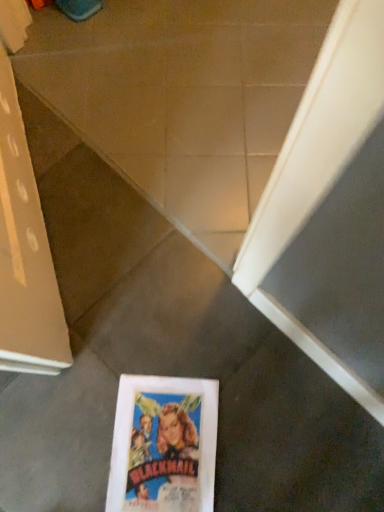
Question: In the image, is white glossy concrete at center positioned in front of or behind multicolored paper at center?

Choices:
 (A) behind
 (B) front

Answer: (A)

Question: From the image's perspective, is white glossy concrete at center located above or below multicolored paper at center?

Choices:
 (A) below
 (B) above

Answer: (B)

Question: From a real-world perspective, is white glossy concrete at center above or below multicolored paper at center?

Choices:
 (A) above
 (B) below

Answer: (B)

Question: Is multicolored paper at center inside or outside of white glossy concrete at center?

Choices:
 (A) outside
 (B) inside

Answer: (A)

Question: In terms of size, does multicolored paper at center appear bigger or smaller than white glossy concrete at center?

Choices:
 (A) small
 (B) big

Answer: (A)

Question: Is multicolored paper at center in front of or behind white glossy concrete at center in the image?

Choices:
 (A) front
 (B) behind

Answer: (A)

Question: Considering the relative positions of multicolored paper at center and white glossy concrete at center in the image provided, is multicolored paper at center to the left or to the right of white glossy concrete at center?

Choices:
 (A) right
 (B) left

Answer: (B)